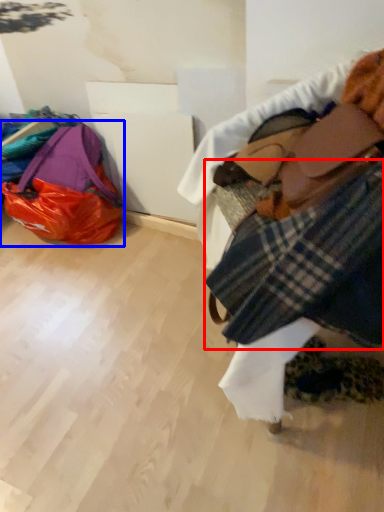
Question: Among these objects, which one is nearest to the camera, flannel (highlighted by a red box) or luggage and bags (highlighted by a blue box)?

Choices:
 (A) flannel
 (B) luggage and bags

Answer: (A)